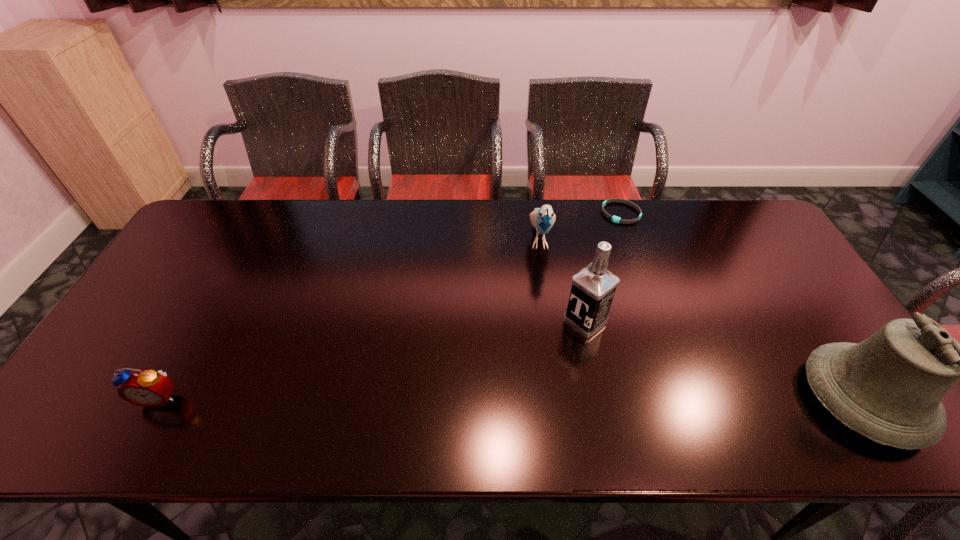
Where is `free space at the far edge of the desktop`? The width and height of the screenshot is (960, 540). free space at the far edge of the desktop is located at coordinates (650, 219).

In the image, there is a desktop. In order to click on vacant space at the near edge in this screenshot , I will do `click(456, 390)`.

Locate an element on the screen. This screenshot has height=540, width=960. free spot at the left edge of the desktop is located at coordinates (144, 315).

You are a GUI agent. You are given a task and a screenshot of the screen. Output one action in this format:
    pyautogui.click(x=<x>, y=<y>)
    Task: Click on the vacant space at the right edge
    This screenshot has height=540, width=960.
    Given the screenshot: What is the action you would take?
    pyautogui.click(x=791, y=301)

In the image, there is a desktop. Where is `vacant space at the far right corner`? vacant space at the far right corner is located at coordinates (735, 235).

You are a GUI agent. You are given a task and a screenshot of the screen. Output one action in this format:
    pyautogui.click(x=<x>, y=<y>)
    Task: Click on the free space between the bird and the third farthest object
    
    Given the screenshot: What is the action you would take?
    pyautogui.click(x=563, y=279)

This screenshot has width=960, height=540. I want to click on vacant space in between the third shortest object and the fourth tallest object, so click(x=349, y=318).

Locate an element on the screen. This screenshot has width=960, height=540. free point between the second shortest object and the third shortest object is located at coordinates click(x=349, y=318).

At what (x,y) coordinates should I click in order to perform the action: click on free space between the fourth object from left to right and the leftmost object. Please return your answer as a coordinate pair (x, y). The height and width of the screenshot is (540, 960). Looking at the image, I should click on (391, 305).

Locate an element on the screen. This screenshot has width=960, height=540. free space between the vodka and the bird is located at coordinates (563, 279).